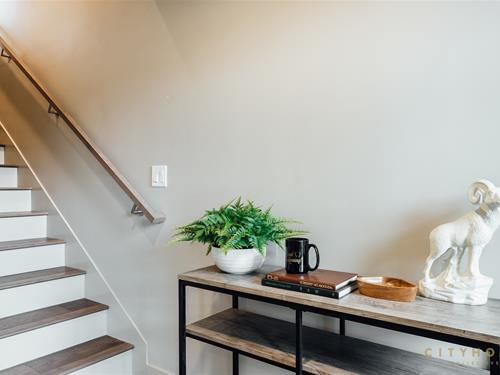
Image resolution: width=500 pixels, height=375 pixels. I want to click on stairs, so click(x=90, y=276), click(x=30, y=172), click(x=12, y=147).